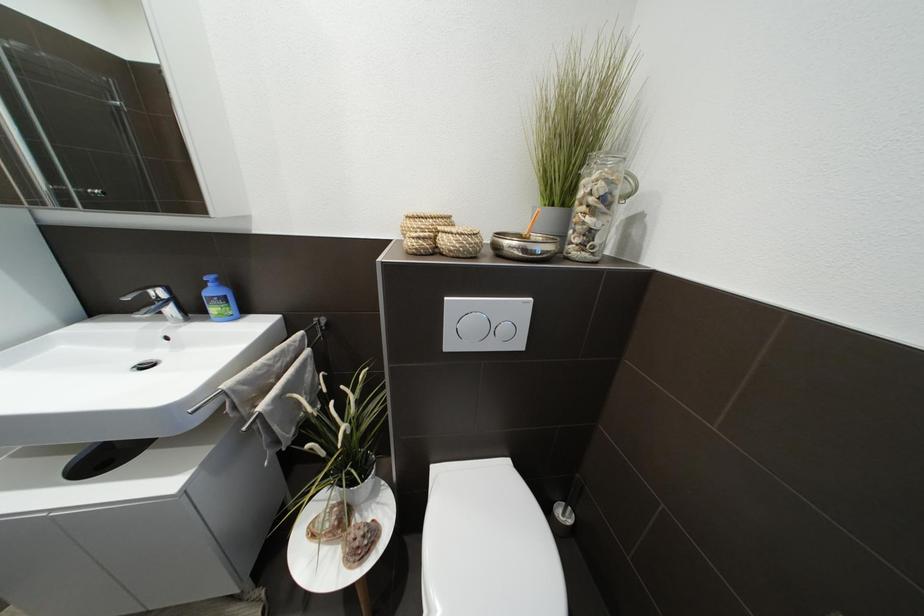
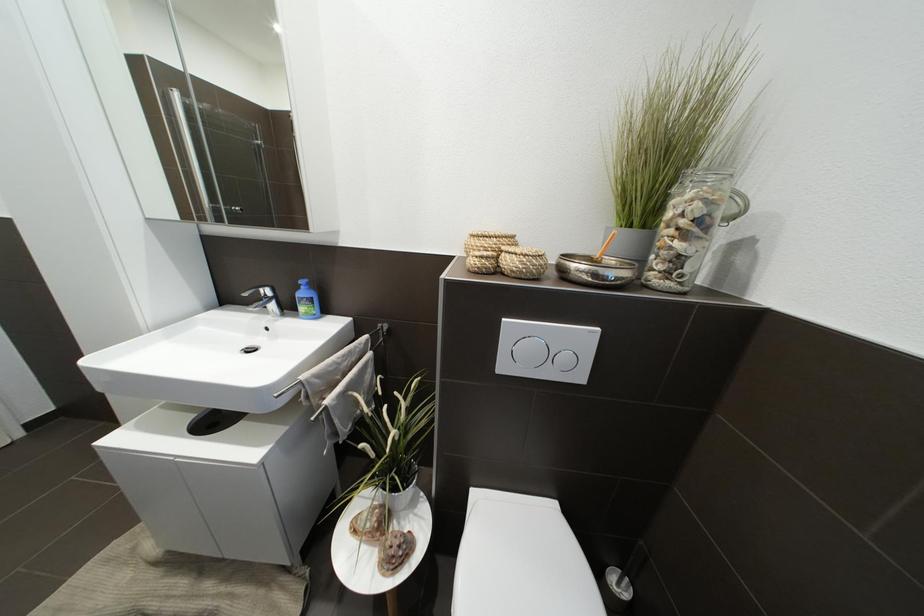
Question: How did the camera likely rotate?

Choices:
 (A) Left
 (B) Right
 (C) Up
 (D) Down

Answer: (A)